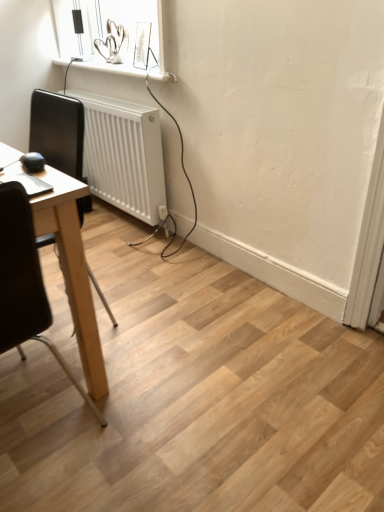
You are a GUI agent. You are given a task and a screenshot of the screen. Output one action in this format:
    pyautogui.click(x=<x>, y=<y>)
    Task: Click on the free spot to the right of black leather chair at left, the second chair positioned from the back
    
    Given the screenshot: What is the action you would take?
    pyautogui.click(x=171, y=368)